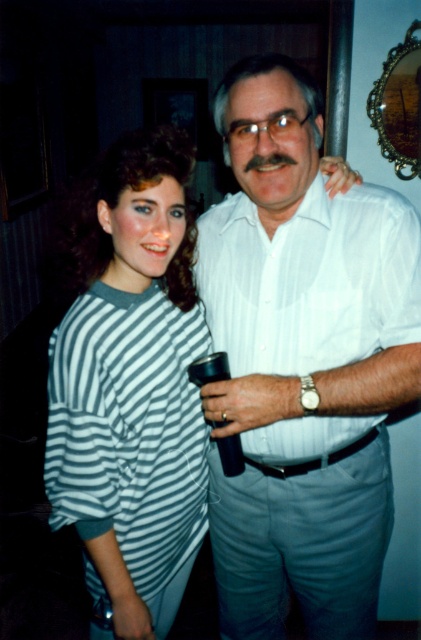
Between striped fabric shirt at center and white striped shirt at center, which one is positioned lower?

striped fabric shirt at center is lower down.

Where is `striped fabric shirt at center`? striped fabric shirt at center is located at coordinates (130, 385).